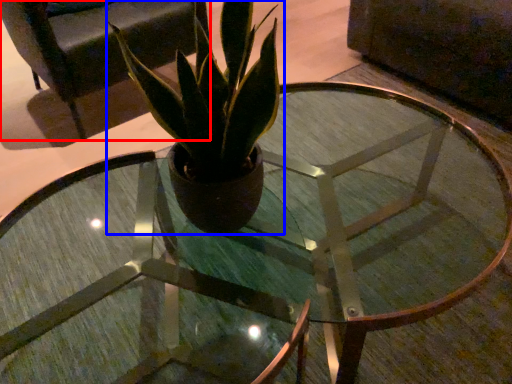
Question: Which object appears closest to the camera in this image, armchair (highlighted by a red box) or houseplant (highlighted by a blue box)?

Choices:
 (A) armchair
 (B) houseplant

Answer: (B)